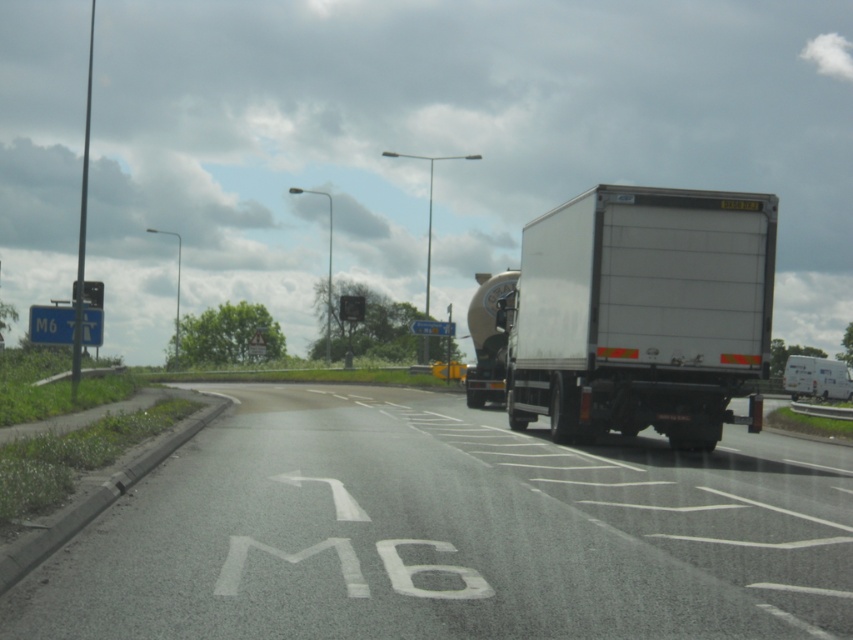
Can you confirm if white asphalt road at lower left is positioned to the right of white matte truck at right?

Incorrect, white asphalt road at lower left is not on the right side of white matte truck at right.

Can you confirm if white asphalt road at lower left is positioned below white matte truck at right?

No.

Is point (816, 580) farther from viewer compared to point (784, 372)?

No.

Where is `white asphalt road at lower left`? The height and width of the screenshot is (640, 853). white asphalt road at lower left is located at coordinates (451, 531).

Does white matte trailer truck at center have a larger size compared to white matte truck at right?

No, white matte trailer truck at center is not bigger than white matte truck at right.

Is white matte trailer truck at center further to the viewer compared to white matte truck at right?

No, white matte trailer truck at center is in front of white matte truck at right.

Which is behind, point (589, 248) or point (833, 396)?

Positioned behind is point (833, 396).

Find the location of a particular element. Image resolution: width=853 pixels, height=640 pixels. white matte trailer truck at center is located at coordinates (642, 312).

Where is `white asphalt road at lower left`? The height and width of the screenshot is (640, 853). white asphalt road at lower left is located at coordinates click(x=451, y=531).

Does point (280, 522) lie in front of point (637, 228)?

Yes, point (280, 522) is closer to viewer.

The width and height of the screenshot is (853, 640). What do you see at coordinates (451, 531) in the screenshot?
I see `white asphalt road at lower left` at bounding box center [451, 531].

In order to click on white asphalt road at lower left in this screenshot , I will do `click(451, 531)`.